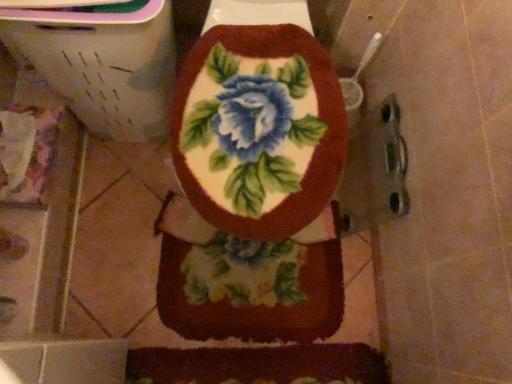
Question: Looking at the image, does floral fabric toilet seat at center seem bigger or smaller compared to fluffy floral rug at center?

Choices:
 (A) big
 (B) small

Answer: (A)

Question: Visually, is floral fabric toilet seat at center positioned to the left or to the right of fluffy floral rug at center?

Choices:
 (A) right
 (B) left

Answer: (B)

Question: Would you say floral fabric toilet seat at center is inside or outside fluffy floral rug at center?

Choices:
 (A) outside
 (B) inside

Answer: (A)

Question: From the image's perspective, is fluffy floral rug at center positioned above or below floral fabric toilet seat at center?

Choices:
 (A) below
 (B) above

Answer: (A)

Question: In terms of width, does fluffy floral rug at center look wider or thinner when compared to floral fabric toilet seat at center?

Choices:
 (A) thin
 (B) wide

Answer: (A)

Question: Based on their positions, is fluffy floral rug at center located to the left or right of floral fabric toilet seat at center?

Choices:
 (A) left
 (B) right

Answer: (B)

Question: Is point (256, 251) positioned closer to the camera than point (194, 233)?

Choices:
 (A) closer
 (B) farther

Answer: (B)